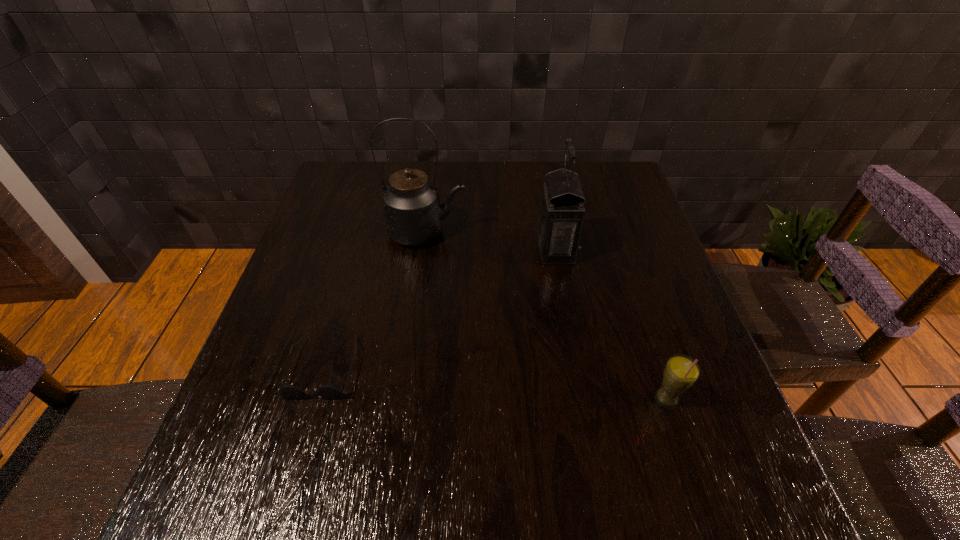
You are a GUI agent. You are given a task and a screenshot of the screen. Output one action in this format:
    pyautogui.click(x=<x>, y=<y>)
    Task: Click on the kettle
    The height and width of the screenshot is (540, 960).
    Given the screenshot: What is the action you would take?
    pyautogui.click(x=413, y=215)

Image resolution: width=960 pixels, height=540 pixels. I want to click on lantern, so click(x=561, y=211).

Find the location of a particular element. the rightmost object is located at coordinates (681, 372).

The height and width of the screenshot is (540, 960). In order to click on the third tallest object in this screenshot , I will do pos(681,372).

The width and height of the screenshot is (960, 540). I want to click on sunglasses, so click(x=331, y=391).

Locate an element on the screen. vacant space located 0.360m spout on the kettle is located at coordinates (600, 233).

Locate an element on the screen. vacant space located 0.260m on the front-facing side of the lantern is located at coordinates (435, 250).

Locate an element on the screen. vacant space located on the front-facing side of the lantern is located at coordinates click(x=509, y=250).

At what (x,y) coordinates should I click in order to perform the action: click on blank area located 0.390m on the front-facing side of the lantern. Please return your answer as a coordinate pair (x, y). Looking at the image, I should click on (385, 250).

The width and height of the screenshot is (960, 540). Find the location of `vacant space located 0.380m on the back of the rightmost object`. vacant space located 0.380m on the back of the rightmost object is located at coordinates (618, 255).